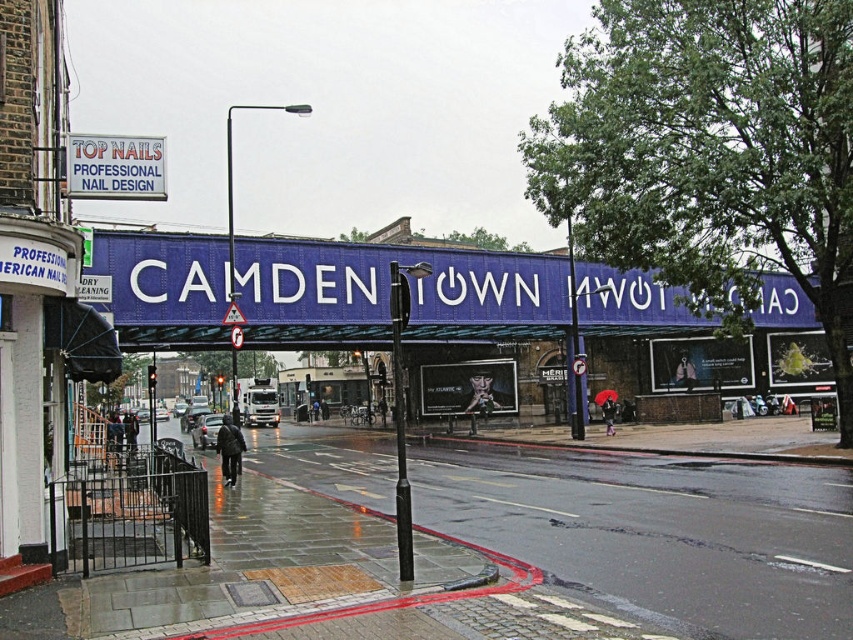
Question: Does white plastic sign at upper left come in front of matte black umbrella at center?

Choices:
 (A) no
 (B) yes

Answer: (B)

Question: Is white plastic sign at upper left to the left of matte black umbrella at center from the viewer's perspective?

Choices:
 (A) yes
 (B) no

Answer: (A)

Question: Which object is closer to the camera taking this photo?

Choices:
 (A) matte black umbrella at center
 (B) concrete sidewalk at lower left

Answer: (B)

Question: Which object is the farthest from the dark gray jacket at center?

Choices:
 (A) concrete sidewalk at lower left
 (B) white plastic sign at upper left
 (C) matte black umbrella at center

Answer: (C)

Question: Which object is the closest to the dark gray jacket at center?

Choices:
 (A) matte black umbrella at center
 (B) white plastic sign at upper left

Answer: (B)

Question: Is white plastic sign at upper left below matte black umbrella at center?

Choices:
 (A) no
 (B) yes

Answer: (A)